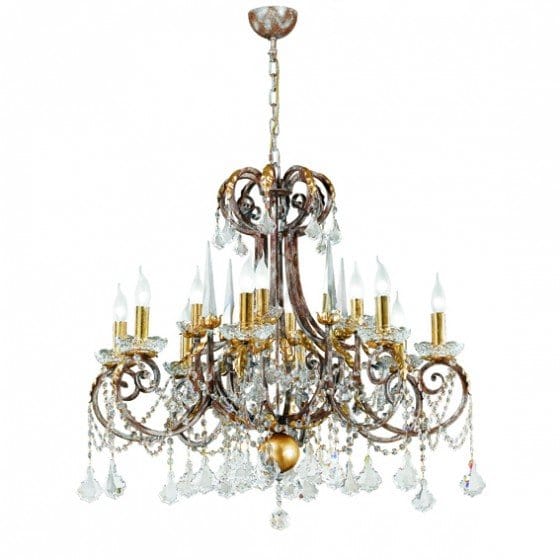
This screenshot has width=560, height=560. What are the coordinates of `crystal hanging charms` in the screenshot? It's located at (480, 478), (424, 494), (396, 482), (361, 483), (331, 478), (311, 471), (291, 494), (242, 483), (181, 483), (82, 488).